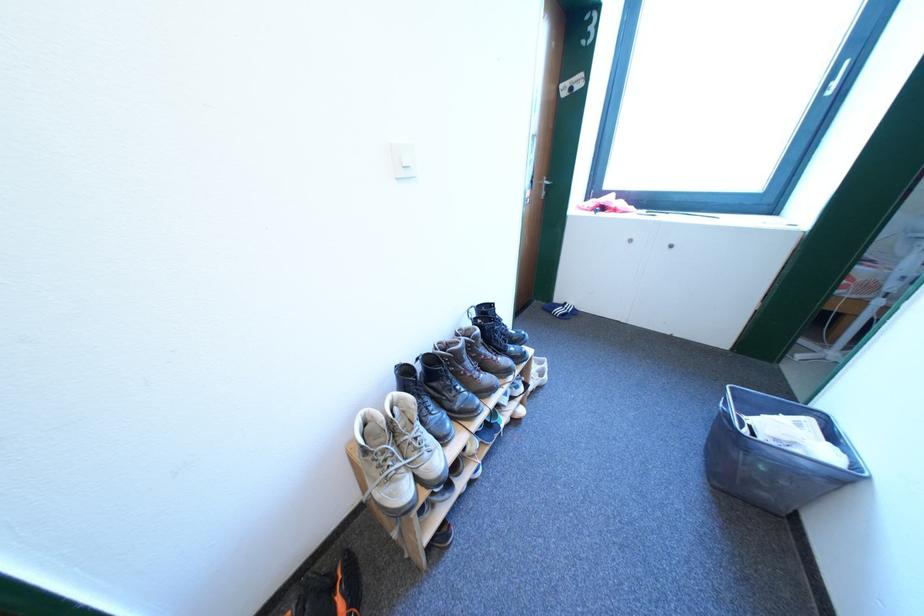
Identify the location of door handle. (544, 187).